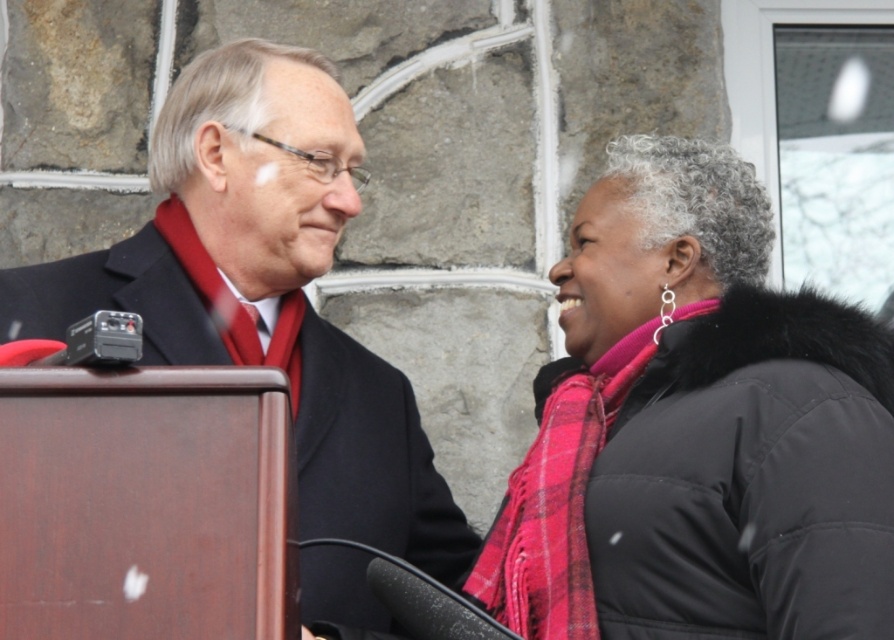
Question: Is pink plaid scarf at right positioned at the back of plaid wool scarf at right?

Choices:
 (A) yes
 (B) no

Answer: (B)

Question: Can you confirm if pink plaid scarf at right is thinner than plaid wool scarf at right?

Choices:
 (A) yes
 (B) no

Answer: (B)

Question: Which point is closer to the camera?

Choices:
 (A) tap(715, 220)
 (B) tap(188, 173)
 (C) tap(502, 520)

Answer: (A)

Question: Among these objects, which one is nearest to the camera?

Choices:
 (A) plaid wool scarf at right
 (B) matte black suit at center

Answer: (A)

Question: Is matte black suit at center smaller than plaid wool scarf at right?

Choices:
 (A) no
 (B) yes

Answer: (A)

Question: Which point is farther to the camera?

Choices:
 (A) plaid wool scarf at right
 (B) pink plaid scarf at right
 (C) matte black suit at center

Answer: (C)